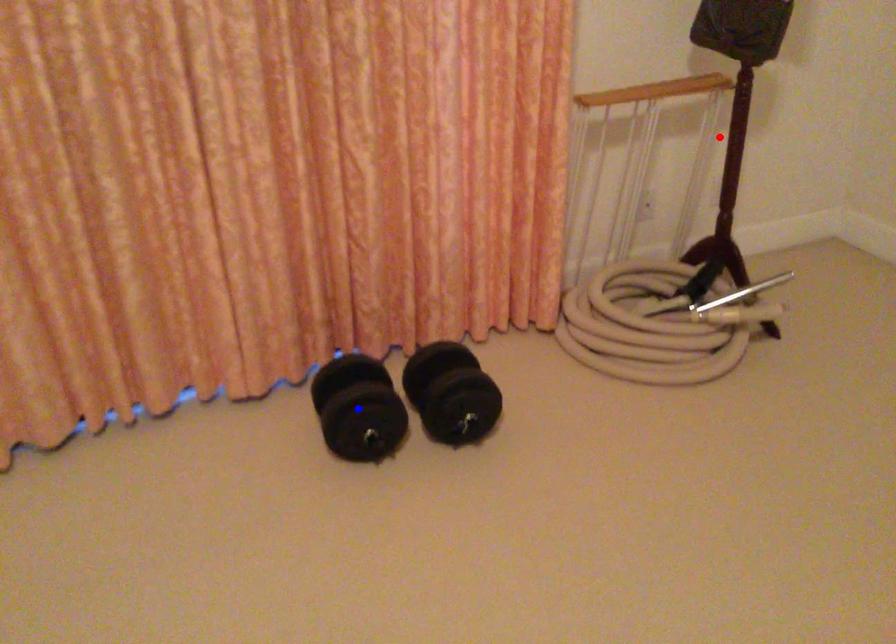
Question: In the image, two points are highlighted. Which point is nearer to the camera? Reply with the corresponding letter.

Choices:
 (A) blue point
 (B) red point

Answer: (A)